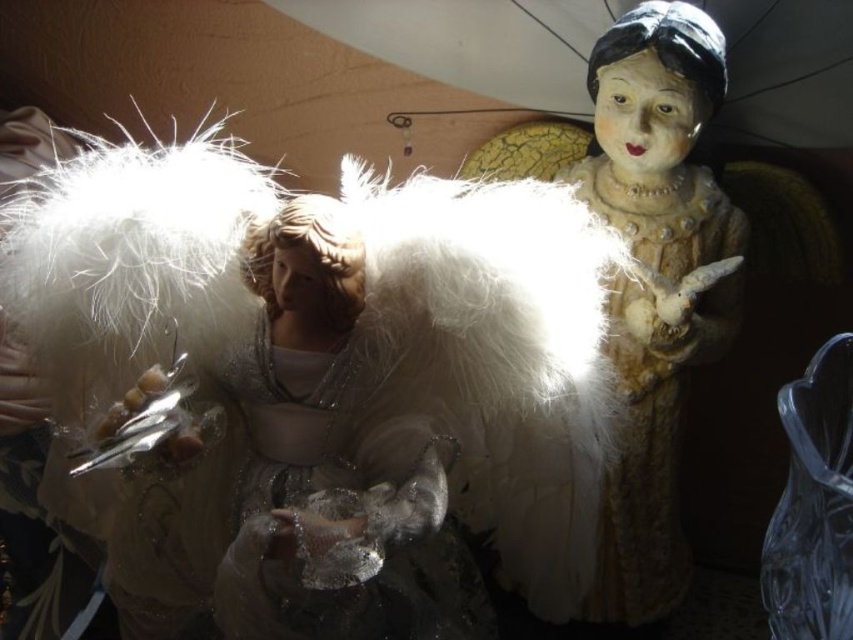
Question: Which of the following is the farthest from the observer?

Choices:
 (A) satin white angel at center
 (B) matte beige statue at center

Answer: (B)

Question: Can you confirm if satin white angel at center is positioned to the right of matte beige statue at center?

Choices:
 (A) no
 (B) yes

Answer: (A)

Question: Among these points, which one is nearest to the camera?

Choices:
 (A) (672, 77)
 (B) (358, 432)

Answer: (B)

Question: Is satin white angel at center closer to the viewer compared to matte beige statue at center?

Choices:
 (A) no
 (B) yes

Answer: (B)

Question: Does satin white angel at center come in front of matte beige statue at center?

Choices:
 (A) no
 (B) yes

Answer: (B)